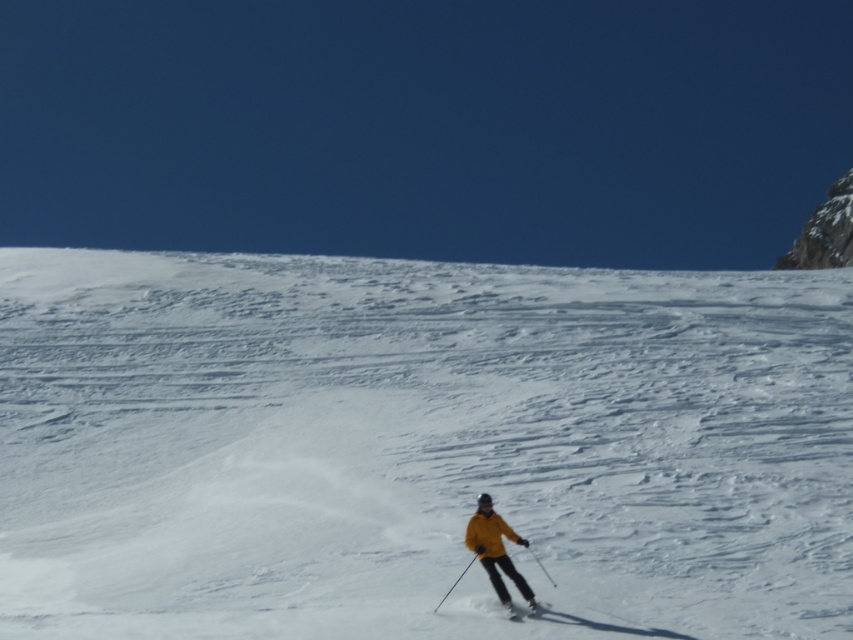
Is point (496, 515) farther from camera compared to point (543, 612)?

Yes, it is behind point (543, 612).

Is point (508, 573) closer to camera compared to point (509, 609)?

No, it is behind (509, 609).

At what (x,y) coordinates should I click in order to perform the action: click on yellow matte jacket at center. Please return your answer as a coordinate pair (x, y). The height and width of the screenshot is (640, 853). Looking at the image, I should click on (495, 550).

Is point (833, 588) more distant than point (509, 612)?

That is True.

Is point (459, 492) closer to camera compared to point (517, 609)?

No, it is behind (517, 609).

At what (x,y) coordinates should I click in order to perform the action: click on white powder snow at center. Please return your answer as a coordinate pair (x, y). Looking at the image, I should click on (418, 445).

Which is more to the left, white powder snow at center or yellow matte jacket at center?

Positioned to the left is yellow matte jacket at center.

Which is in front, point (67, 544) or point (463, 544)?

Point (463, 544)

Does point (335, 538) lie behind point (479, 520)?

Yes, point (335, 538) is farther from viewer.

Where is `white powder snow at center`? The width and height of the screenshot is (853, 640). white powder snow at center is located at coordinates (418, 445).